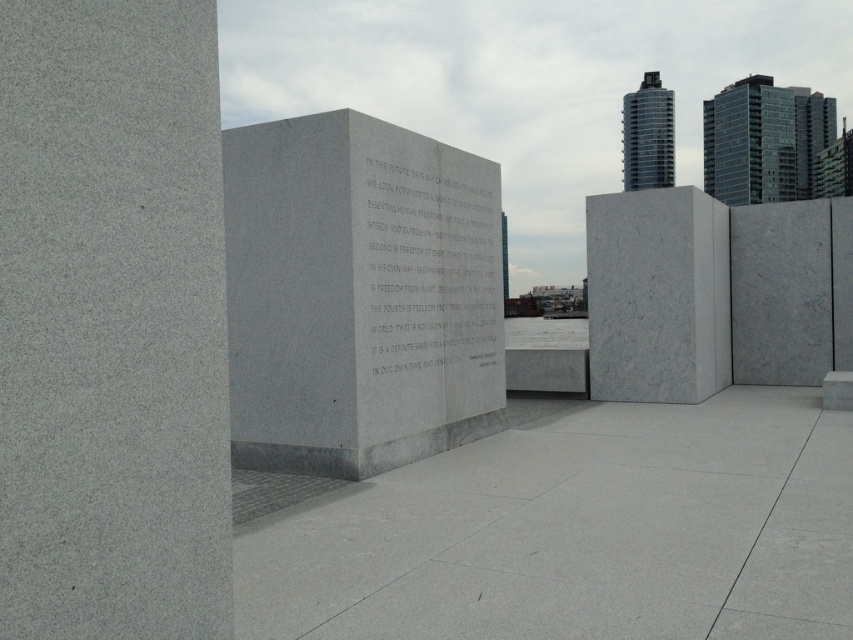
Question: Does gray granite pillar at center have a larger size compared to white marble monument at center?

Choices:
 (A) no
 (B) yes

Answer: (A)

Question: Which of these objects is positioned closest to the white marble pillar at center?

Choices:
 (A) gray polished concrete at center
 (B) white marble stone at center
 (C) white marble monument at center
 (D) gray granite pillar at center

Answer: (B)

Question: Is gray polished concrete at center wider than white marble monument at center?

Choices:
 (A) no
 (B) yes

Answer: (A)

Question: Which object is closer to the camera taking this photo?

Choices:
 (A) white marble pillar at center
 (B) white marble stone at center
 (C) gray granite pillar at center

Answer: (C)

Question: Is gray granite pillar at center further to camera compared to white marble monument at center?

Choices:
 (A) no
 (B) yes

Answer: (A)

Question: Which point is closer to the camera taking this photo?

Choices:
 (A) (360, 198)
 (B) (410, 252)
 (C) (592, 483)

Answer: (C)